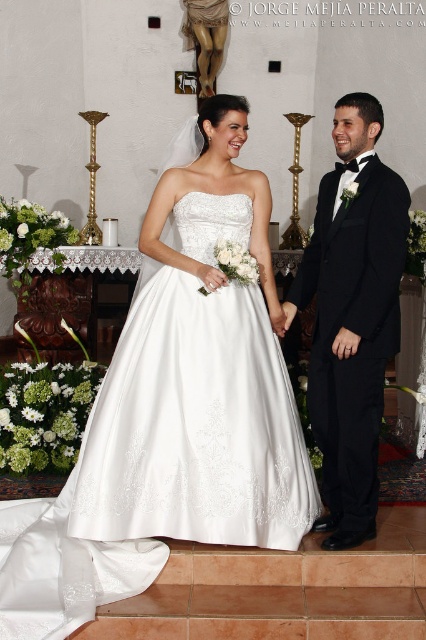
You are a photographer at the wedding. You need to position a spotlight exactly at point (198, 372) to highlight the main subject. According to the scene description, what object will be illuminated by this spotlight?

The spotlight at point (198, 372) will illuminate the white satin dress at center.